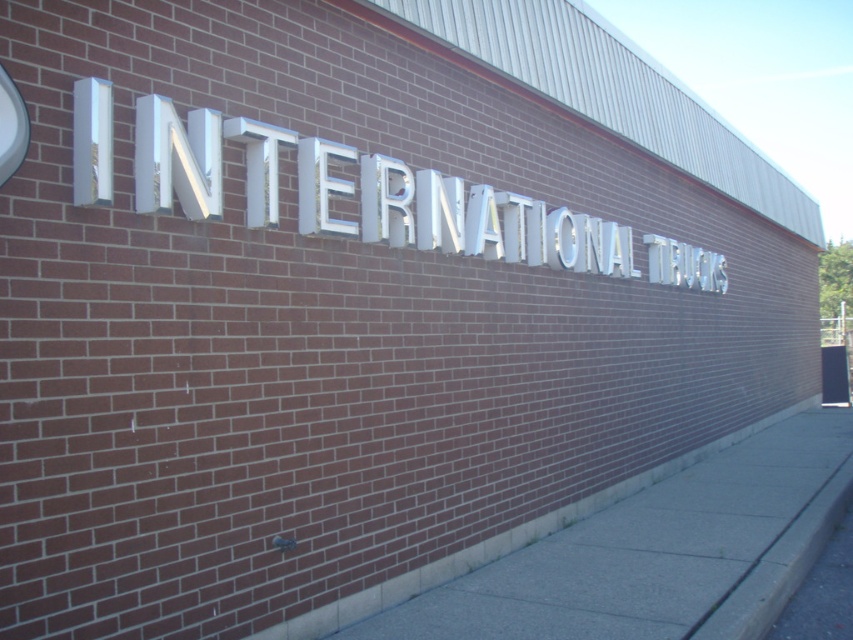
Can you confirm if gray concrete sidewalk at lower center is wider than white metallic sign at center?

Indeed, gray concrete sidewalk at lower center has a greater width compared to white metallic sign at center.

Consider the image. How much distance is there between gray concrete sidewalk at lower center and white metallic sign at center?

gray concrete sidewalk at lower center is 4.96 meters away from white metallic sign at center.

The height and width of the screenshot is (640, 853). Find the location of `gray concrete sidewalk at lower center`. gray concrete sidewalk at lower center is located at coordinates (647, 552).